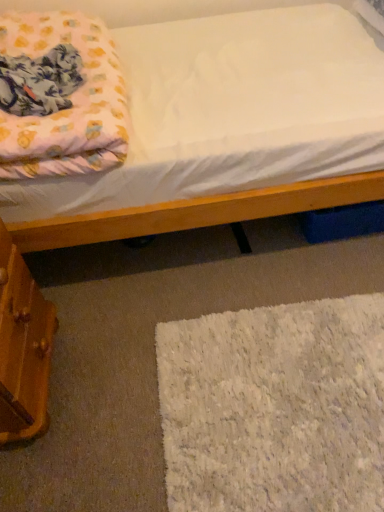
The width and height of the screenshot is (384, 512). I want to click on vacant space that is to the left of white fluffy rug at lower right, so click(x=100, y=381).